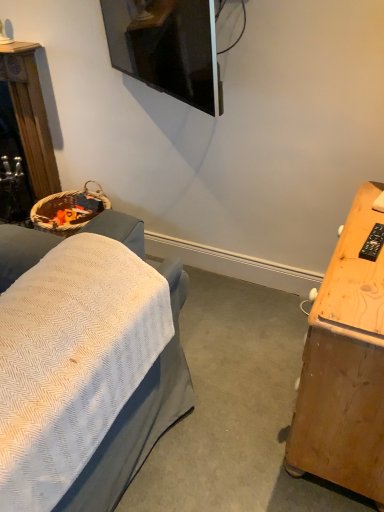
Question: Are woven basket at left and light brown wood desk at right making contact?

Choices:
 (A) yes
 (B) no

Answer: (B)

Question: From the image's perspective, does woven basket at left appear higher than light brown wood desk at right?

Choices:
 (A) yes
 (B) no

Answer: (A)

Question: Is woven basket at left closer to camera compared to light brown wood desk at right?

Choices:
 (A) yes
 (B) no

Answer: (B)

Question: Is woven basket at left further to camera compared to light brown wood desk at right?

Choices:
 (A) no
 (B) yes

Answer: (B)

Question: Can you confirm if woven basket at left is bigger than light brown wood desk at right?

Choices:
 (A) no
 (B) yes

Answer: (A)

Question: From a real-world perspective, is woven basket at left on light brown wood desk at right?

Choices:
 (A) no
 (B) yes

Answer: (B)

Question: Can you confirm if light brown wood desk at right is positioned to the left of woven basket at left?

Choices:
 (A) no
 (B) yes

Answer: (A)

Question: Could you tell me if light brown wood desk at right is turned towards woven basket at left?

Choices:
 (A) no
 (B) yes

Answer: (B)

Question: From the image's perspective, is light brown wood desk at right on woven basket at left?

Choices:
 (A) no
 (B) yes

Answer: (A)

Question: Is light brown wood desk at right with woven basket at left?

Choices:
 (A) yes
 (B) no

Answer: (B)

Question: Is light brown wood desk at right positioned with its back to woven basket at left?

Choices:
 (A) no
 (B) yes

Answer: (A)

Question: Is light brown wood desk at right positioned far away from woven basket at left?

Choices:
 (A) yes
 (B) no

Answer: (A)

Question: Does point (31, 152) appear closer or farther from the camera than point (332, 348)?

Choices:
 (A) farther
 (B) closer

Answer: (A)